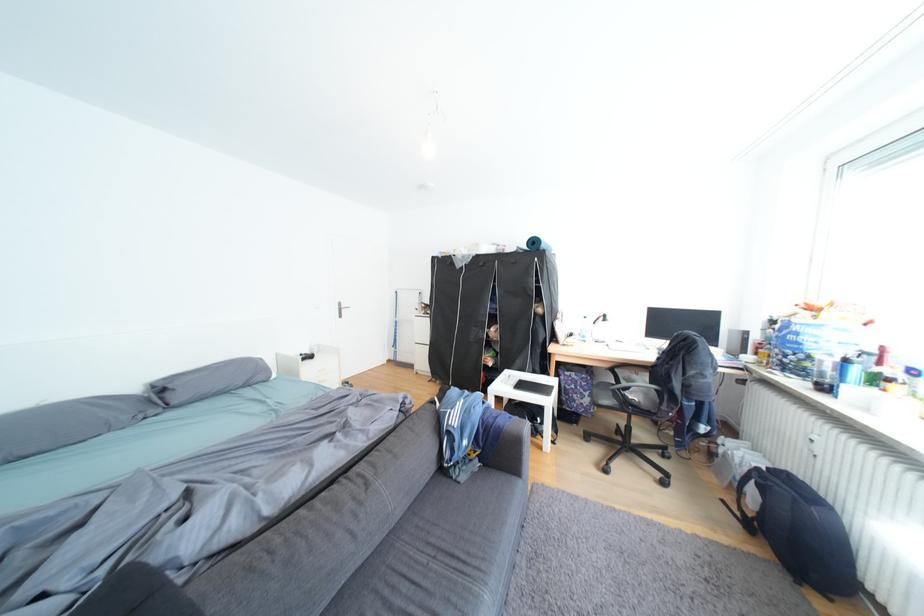
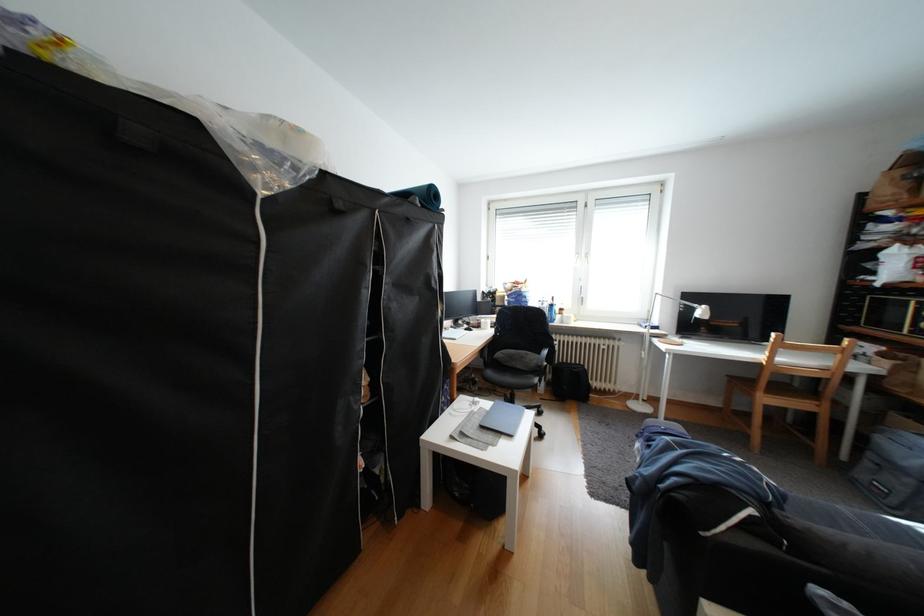
Question: I am providing you with two images of the same scene from different viewpoints. Please identify which objects are invisible in image2.

Choices:
 (A) black chair sitting surface
 (B) yellow lidded cup
 (C) clear water bottle
 (D) blue rolled mat

Answer: (C)